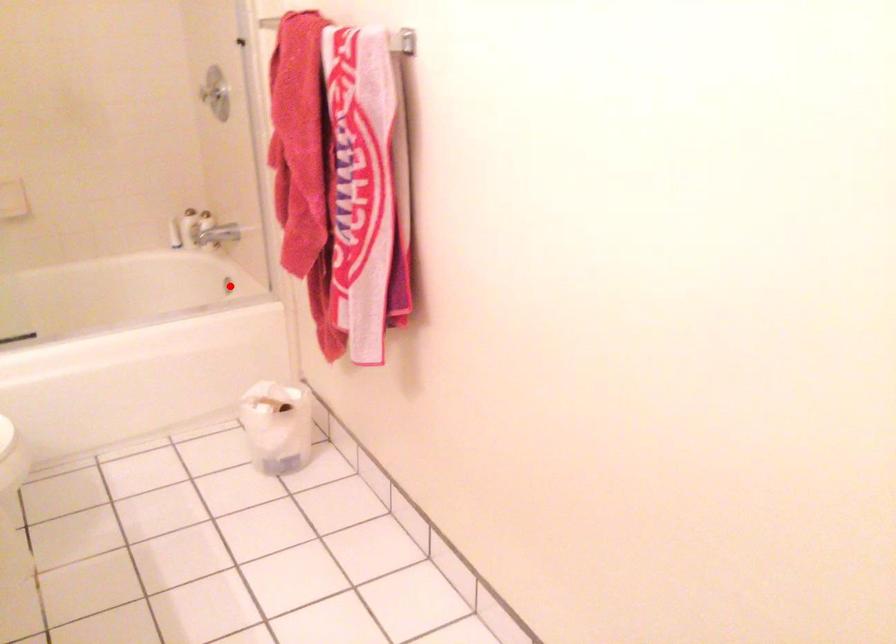
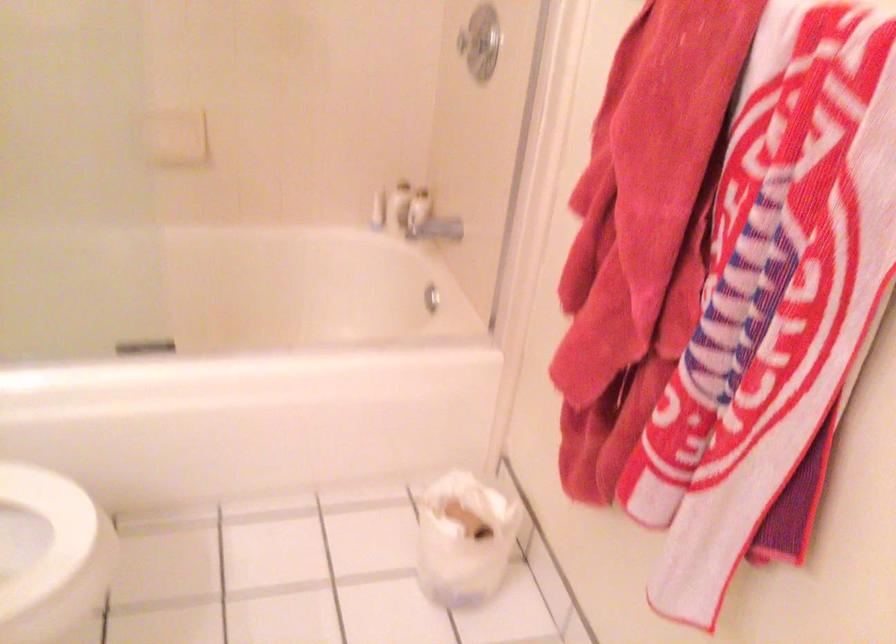
Question: I am providing you with two images of the same scene from different viewpoints. A red point is shown in image1. For the corresponding object point in image2, is it positioned nearer or farther from the camera?

Choices:
 (A) Nearer
 (B) Farther

Answer: (A)